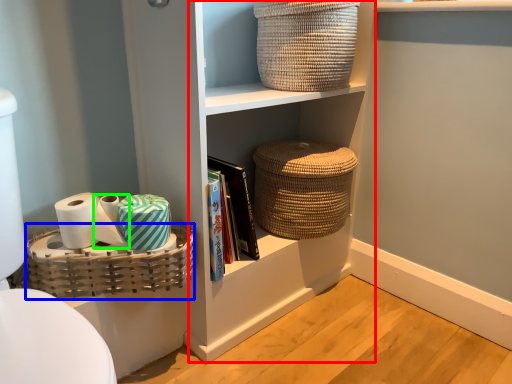
Question: Estimate the real-world distances between objects in this image. Which object is closer to cabinet (highlighted by a red box), basket (highlighted by a blue box) or toilet paper (highlighted by a green box)?

Choices:
 (A) basket
 (B) toilet paper

Answer: (A)